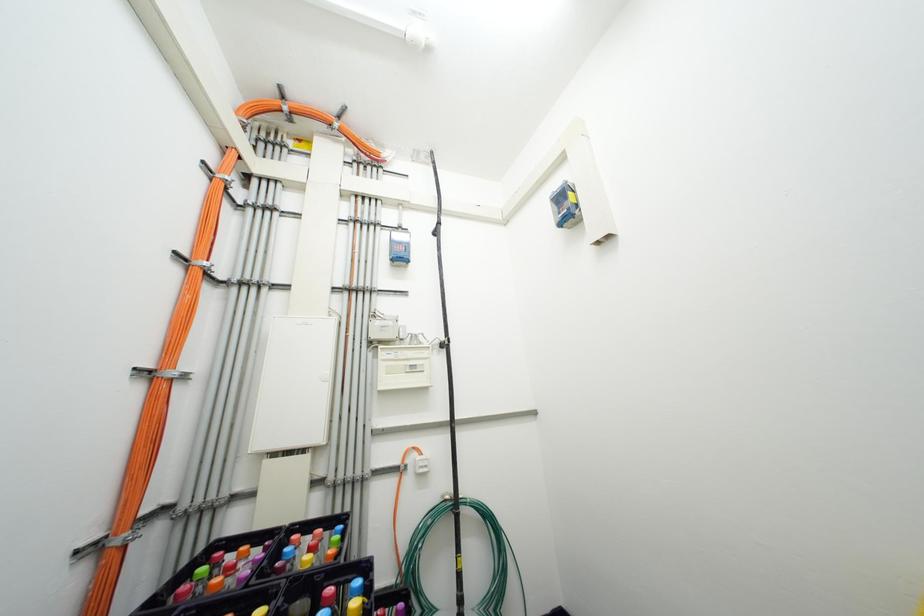
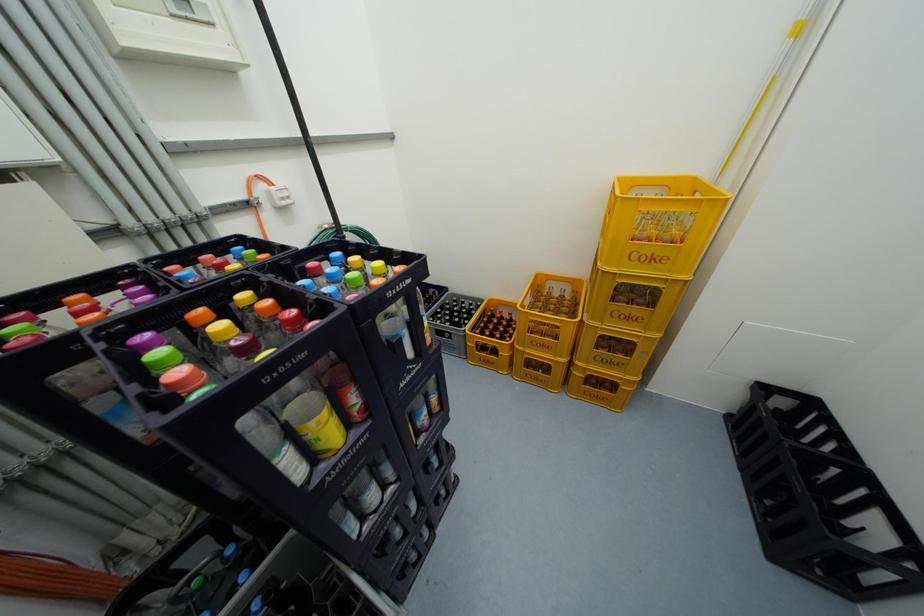
The first image is from the beginning of the video and the second image is from the end. How did the camera likely rotate when shooting the video?

The rotation direction of the camera is right-down.